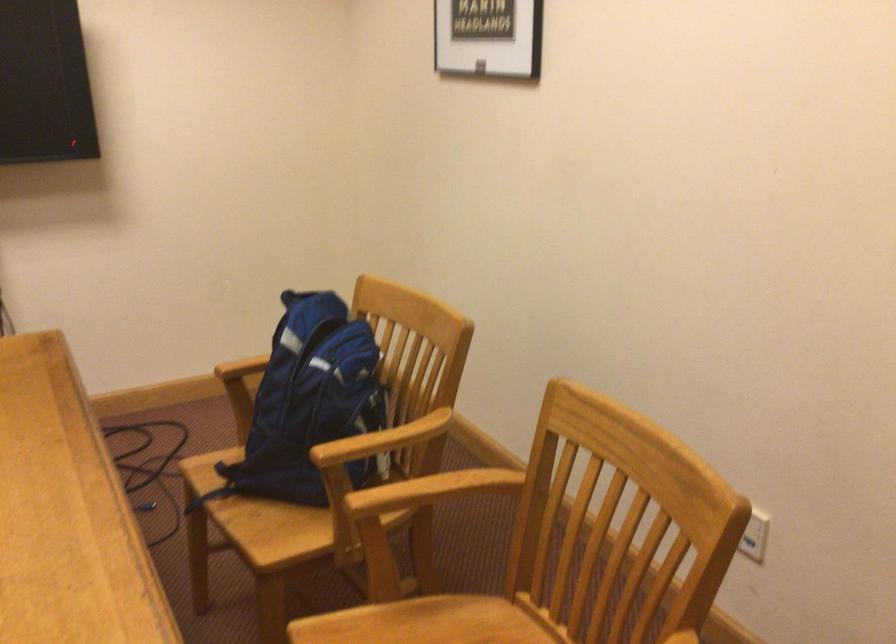
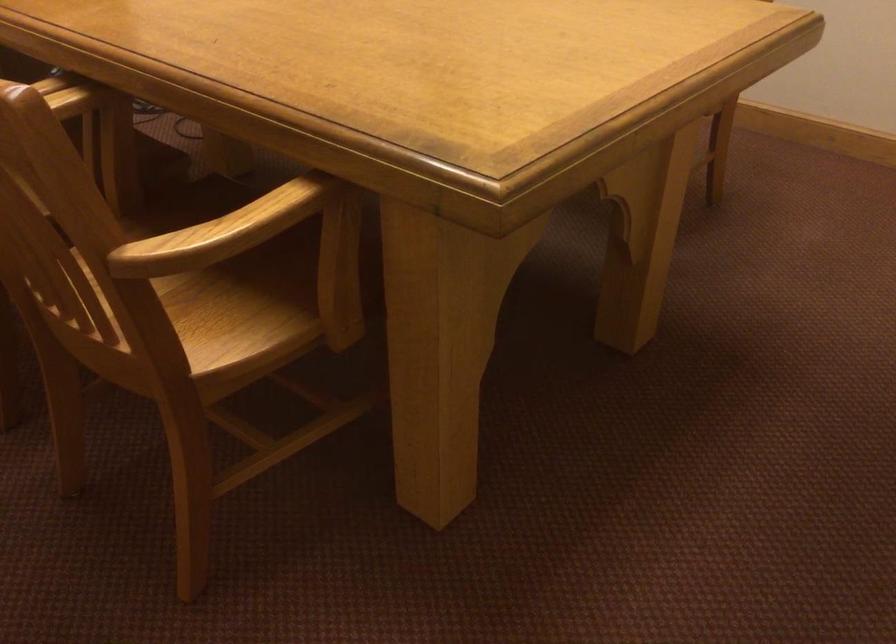
What movement of the cameraman would produce the second image?

The cameraman walked toward left, backward.